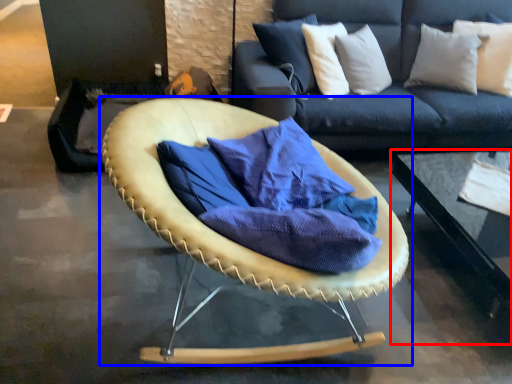
Question: Which of the following is the farthest to the observer, table (highlighted by a red box) or chair (highlighted by a blue box)?

Choices:
 (A) table
 (B) chair

Answer: (A)